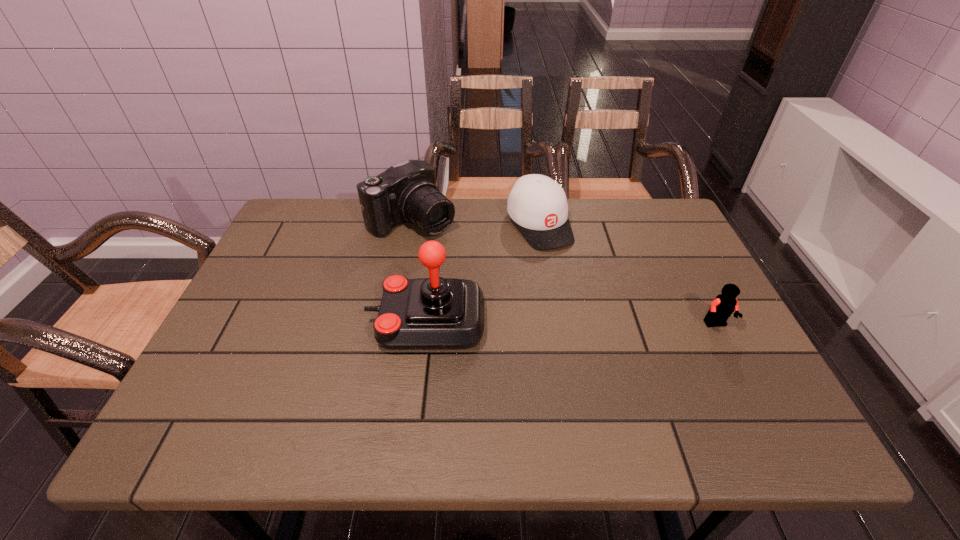
This screenshot has height=540, width=960. I want to click on vacant space on the desktop that is between the joystick and the rightmost object and is positioned on the front-facing side of the baseball cap, so click(609, 323).

The image size is (960, 540). I want to click on free space on the desktop that is between the tallest object and the rightmost object and is positioned on the lens of the camera, so click(x=531, y=322).